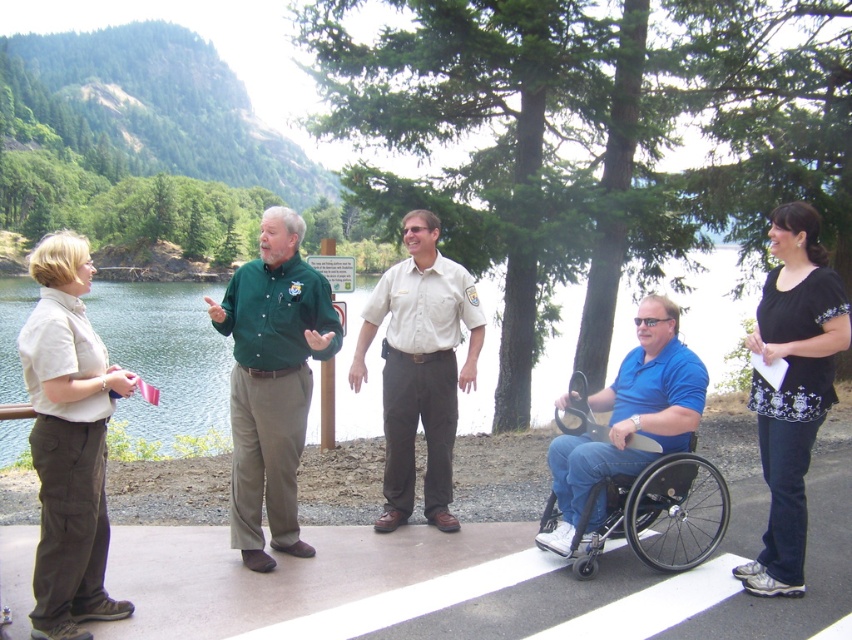
You are a photographer trying to capture a candid shot of the green shirt at center without including the clear water at left in the background. Based on their positions, is this possible?

The clear water at left is located above the green shirt at center, so if you position your camera below the green shirt at center, you can avoid including the clear water at left in the background.

You are a photographer wanting to capture both the clear water at left and the green shirt at center in a single shot. Given the distance between them, will you need to adjust your camera to a wider angle to ensure both are fully visible?

The clear water at left and green shirt at center are 101.63 feet apart. To capture both in a single shot, you would need to use a wider angle lens or move further back to include both in the frame.

You are a photographer planning to capture a group photo of the green shirt at center and the black plastic wheelchair at center. Given their sizes, which one should you position closer to the camera to maintain clarity in the photo?

The green shirt at center is wider than the black plastic wheelchair at center, so positioning the green shirt at center closer to the camera will help maintain clarity as larger objects are typically placed nearer for better focus.